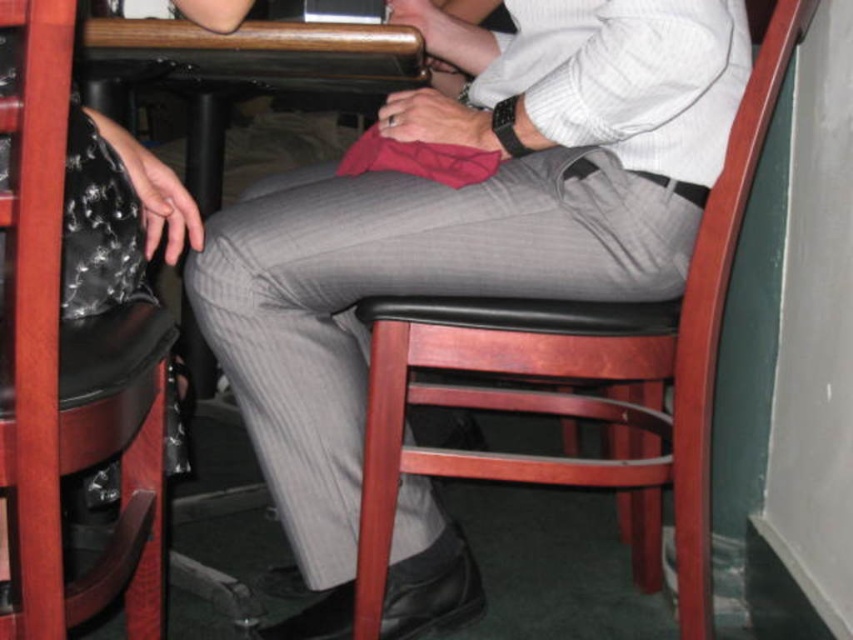
You are a photographer trying to capture a detailed shot of the wooden table at center. You are currently positioned to take a photo of the wooden chair at center. Can you take the photo without moving your camera position?

The wooden chair at center is closer to the viewer than the wooden table at center, so the chair will block the view of the table. You need to move your camera position to capture the wooden table at center without obstruction.

You are designing a seating arrangement for a small meeting. You have two chairs available, the wooden chair at center and the black leather chair at center. If you want to choose the bigger chair for the guest of honor, which one should you pick?

The wooden chair at center is larger in size compared to the black leather chair at center, so you should choose the wooden chair at center for the guest of honor.

Based on the photo, you are a waiter carrying a tray of drinks. You need to place them on the table without spilling. The tray is 50 centimeters wide. Can you safely place the tray on the wooden table at center between the black leather chair at center and the other chair? Explain why.

The black leather chair at center is 51.24 centimeters from the wooden table at center. Since the tray is 50 centimeters wide, it can fit between them with a small gap of 1.24 centimeters. However, placing the tray might risk spilling due to the narrow space. It is not recommended unless necessary.